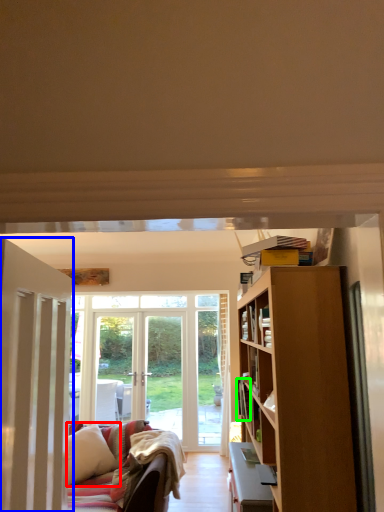
Question: Which object is positioned closest to pillow (highlighted by a red box)? Select from door (highlighted by a blue box) and book (highlighted by a green box).

Choices:
 (A) door
 (B) book

Answer: (B)